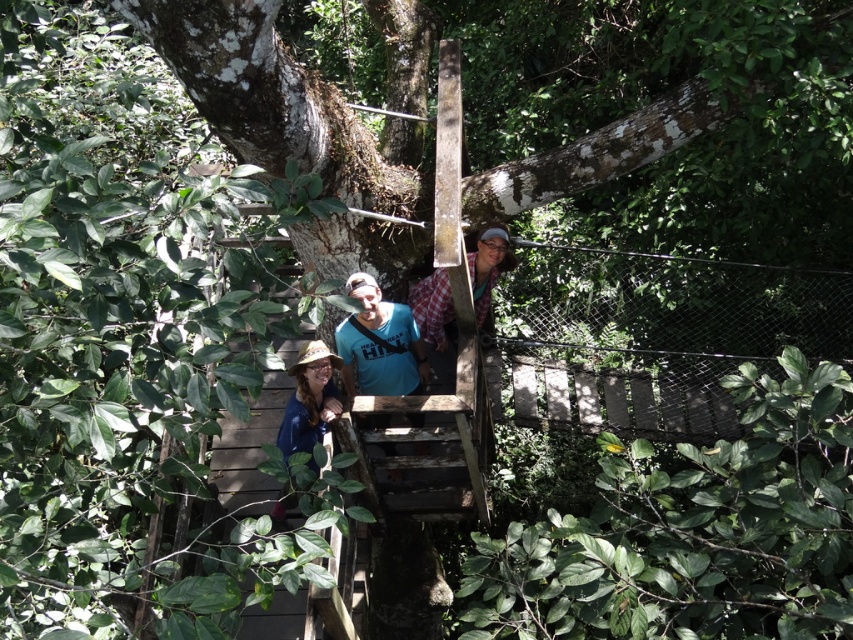
Question: Is blue t-shirt at center to the right of matte blue shirt at lower left from the viewer's perspective?

Choices:
 (A) no
 (B) yes

Answer: (B)

Question: Which point is closer to the camera taking this photo?

Choices:
 (A) (374, 388)
 (B) (311, 445)

Answer: (B)

Question: Which point is farther to the camera?

Choices:
 (A) matte blue shirt at lower left
 (B) blue t-shirt at center

Answer: (B)

Question: Is blue t-shirt at center to the left of matte blue shirt at lower left from the viewer's perspective?

Choices:
 (A) yes
 (B) no

Answer: (B)

Question: Where is blue t-shirt at center located in relation to matte blue shirt at lower left in the image?

Choices:
 (A) below
 (B) above

Answer: (B)